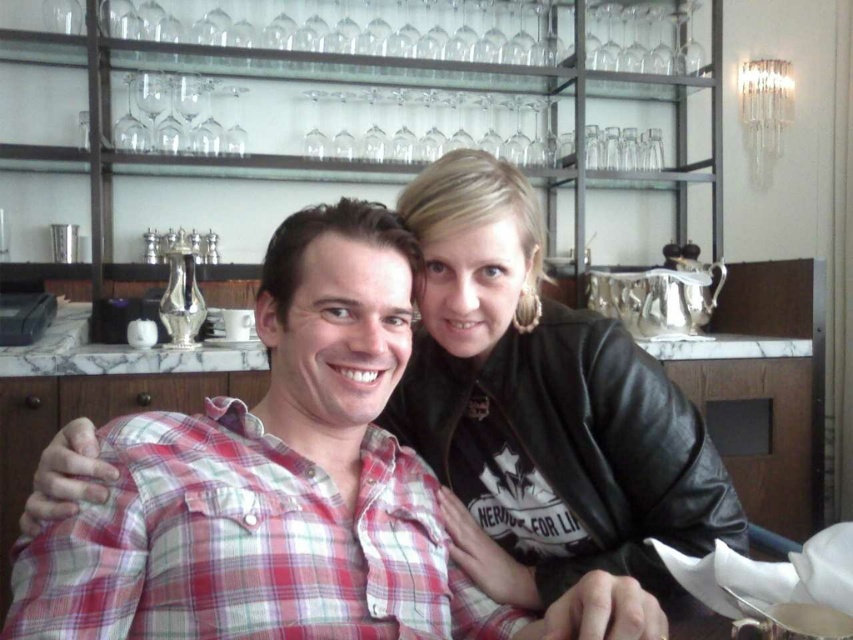
You are a bartender who needs to place a new order of wine glasses on the metal shelving unit behind the counter. The plaid cotton shirt at center and the black leather jacket at upper right are currently blocking your access to the shelves. Which person should you ask to move so you can reach the shelves?

You should ask the black leather jacket at upper right to move because the plaid cotton shirt at center is to the left of black leather jacket at upper right, meaning the black leather jacket at upper right is closer to the shelving unit and blocking access.

You are a tailor who needs to determine which garment requires more fabric for alterations. Based on the image, which of the two items, the plaid cotton shirt at center or the black leather jacket at upper right, would need more fabric due to its size?

The plaid cotton shirt at center requires more fabric for alterations because it has a larger size compared to the black leather jacket at upper right.

You are standing at the bar counter and want to place a small item between the two points labeled point (x=263, y=470) and point (x=425, y=243). Which point should you move towards to position the item closer to the front of the bar?

To place the item closer to the front of the bar, you should move towards point (x=263, y=470) because it is in front of point (x=425, y=243).